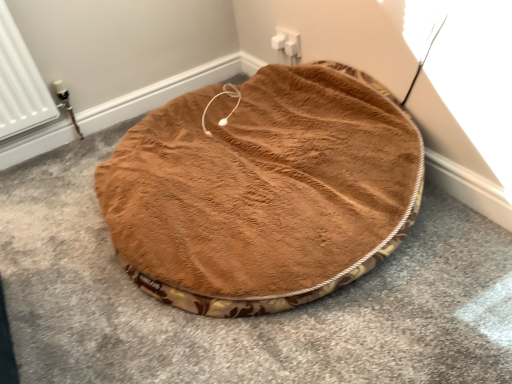
Question: From a real-world perspective, relative to white plastic electric outlet at upper center, is brown plush dog bed at center vertically above or below?

Choices:
 (A) below
 (B) above

Answer: (A)

Question: Considering the positions of brown plush dog bed at center and white plastic electric outlet at upper center in the image, is brown plush dog bed at center bigger or smaller than white plastic electric outlet at upper center?

Choices:
 (A) small
 (B) big

Answer: (B)

Question: From the image's perspective, is brown plush dog bed at center positioned above or below white plastic electric outlet at upper center?

Choices:
 (A) above
 (B) below

Answer: (B)

Question: Looking at the image, does white plastic electric outlet at upper center seem bigger or smaller compared to brown plush dog bed at center?

Choices:
 (A) small
 (B) big

Answer: (A)

Question: Considering the positions of white plastic electric outlet at upper center and brown plush dog bed at center in the image, is white plastic electric outlet at upper center wider or thinner than brown plush dog bed at center?

Choices:
 (A) wide
 (B) thin

Answer: (B)

Question: In the image, is white plastic electric outlet at upper center positioned in front of or behind brown plush dog bed at center?

Choices:
 (A) front
 (B) behind

Answer: (B)

Question: Considering the relative positions of white plastic electric outlet at upper center and brown plush dog bed at center in the image provided, is white plastic electric outlet at upper center to the left or to the right of brown plush dog bed at center?

Choices:
 (A) left
 (B) right

Answer: (B)